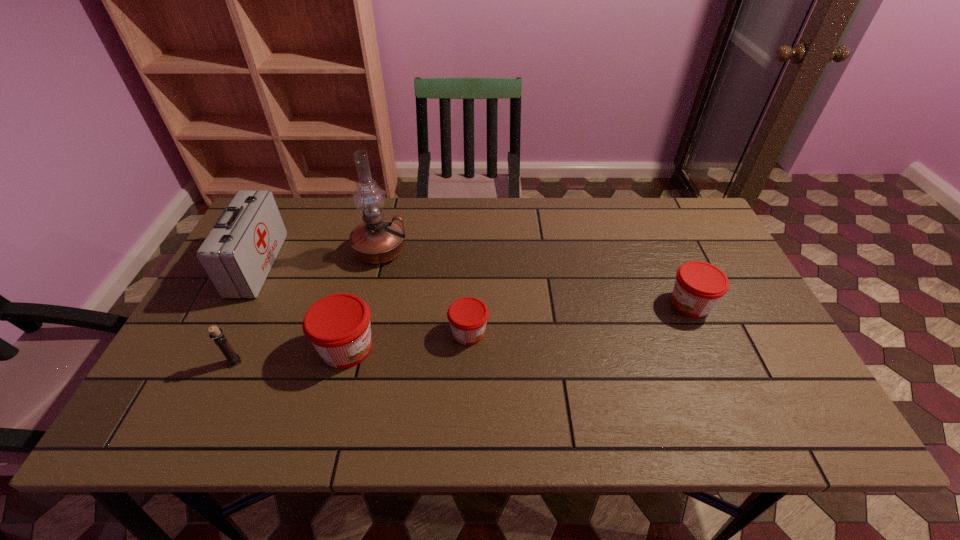
The image size is (960, 540). What are the coordinates of `vacant space located on the label side of the second jam from left to right` in the screenshot? It's located at (621, 332).

Where is `vacant region located on the label side of the second tallest jam`? This screenshot has width=960, height=540. vacant region located on the label side of the second tallest jam is located at coordinates (595, 303).

In order to click on vacant space located 0.350m on the label side of the second tallest jam in this screenshot , I will do `click(535, 303)`.

What are the coordinates of `vacant area situated on the label side of the second tallest jam` in the screenshot? It's located at (595, 303).

You are a GUI agent. You are given a task and a screenshot of the screen. Output one action in this format:
    pyautogui.click(x=<x>, y=<y>)
    Task: Click on the free space located on the front-facing side of the leftmost object
    The height and width of the screenshot is (540, 960).
    Given the screenshot: What is the action you would take?
    pyautogui.click(x=304, y=265)

This screenshot has width=960, height=540. In order to click on vacant area situated on the front of the tallest object in this screenshot , I will do `click(370, 298)`.

Where is `vacant point located on the right of the candle holder`? vacant point located on the right of the candle holder is located at coordinates (280, 362).

The height and width of the screenshot is (540, 960). In order to click on the first-aid kit present at the far edge in this screenshot , I will do `click(237, 255)`.

Locate an element on the screen. This screenshot has width=960, height=540. oil lamp present at the far edge is located at coordinates (377, 240).

You are a GUI agent. You are given a task and a screenshot of the screen. Output one action in this format:
    pyautogui.click(x=<x>, y=<y>)
    Task: Click on the jam that is positioned at the near edge
    
    Given the screenshot: What is the action you would take?
    pyautogui.click(x=338, y=325)